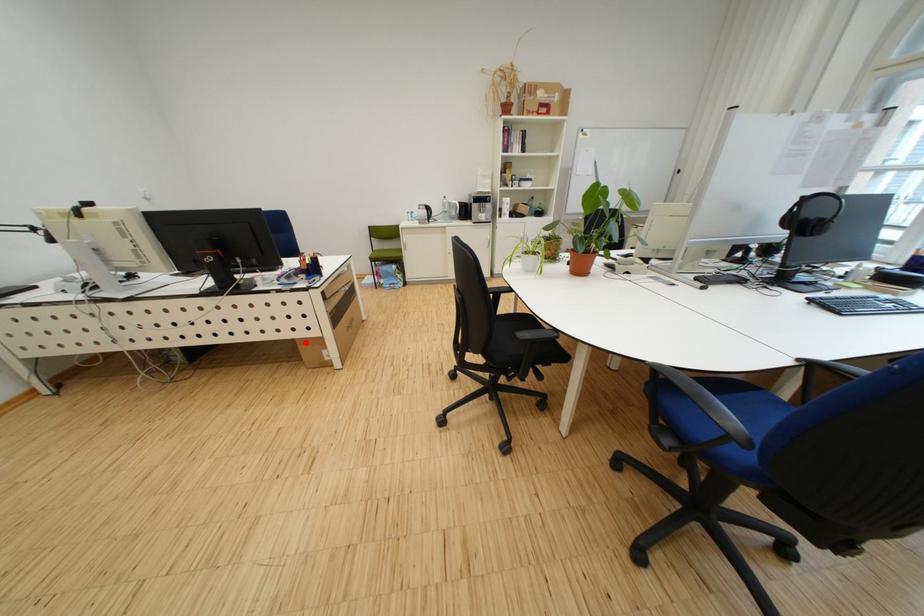
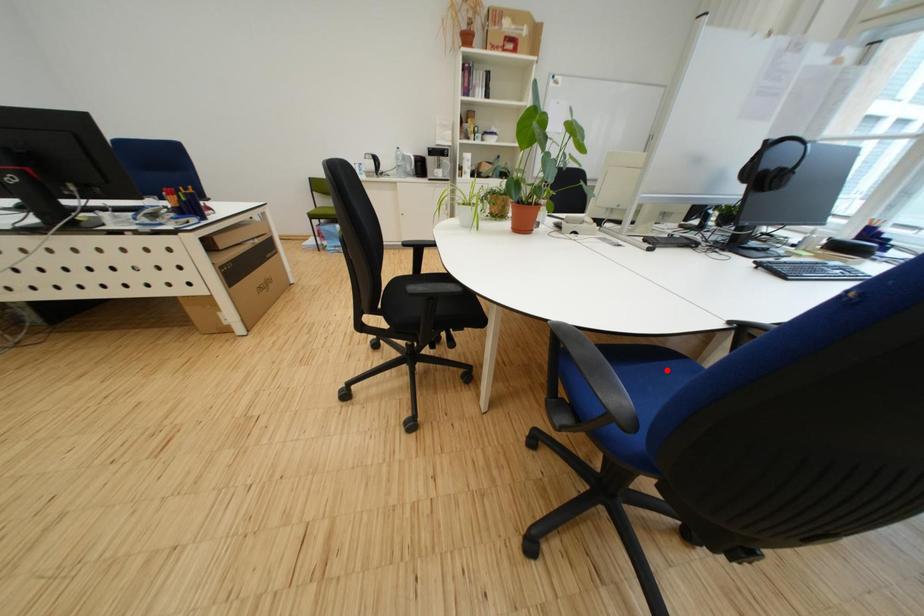
I am providing you with two images of the same scene from different viewpoints. A red point is marked on the first image and another point is marked on the second image. Is the marked point in image1 the same physical position as the marked point in image2?

No